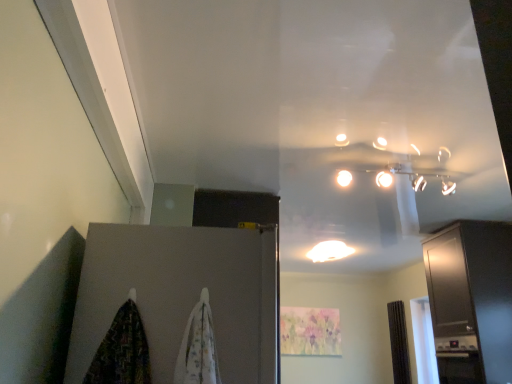
Where is `white glossy light fixture at center`? white glossy light fixture at center is located at coordinates (329, 251).

What do you see at coordinates (180, 295) in the screenshot? I see `matte gray door at lower left` at bounding box center [180, 295].

At what (x,y) coordinates should I click in order to perform the action: click on satin black cabinet at right. Please return your answer as a coordinate pair (x, y). This screenshot has width=512, height=384. Looking at the image, I should click on (471, 301).

From the image's perspective, which one is positioned higher, satin black cabinet at right or matte gray door at lower left?

matte gray door at lower left, from the image's perspective.

Is satin black cabinet at right facing towards matte gray door at lower left?

No, satin black cabinet at right is not oriented towards matte gray door at lower left.

Does satin black cabinet at right have a greater height compared to matte gray door at lower left?

Yes, satin black cabinet at right is taller than matte gray door at lower left.

Is the depth of satin black cabinet at right greater than that of brown textured curtain at right, positioned as the 1th curtain in back-to-front order?

No, it is not.

Is satin black cabinet at right facing towards brown textured curtain at right, marked as the second curtain in a left-to-right arrangement?

No.

Considering the sizes of satin black cabinet at right and brown textured curtain at right, positioned as the 1th curtain in back-to-front order, in the image, is satin black cabinet at right wider or thinner than brown textured curtain at right, positioned as the 1th curtain in back-to-front order,?

Considering their sizes, satin black cabinet at right looks broader than brown textured curtain at right, positioned as the 1th curtain in back-to-front order.

From the image's perspective, relative to brown textured curtain at right, marked as the second curtain in a left-to-right arrangement, is satin black cabinet at right above or below?

satin black cabinet at right is situated higher than brown textured curtain at right, marked as the second curtain in a left-to-right arrangement, in the image.

From a real-world perspective, between white fabric curtain at center, which appears as the 2th curtain when ordered from the bottom, and brown textured curtain at right, which ranks as the second curtain in front-to-back order, who is vertically higher?

From a 3D spatial view, brown textured curtain at right, which ranks as the second curtain in front-to-back order, is above.

In terms of height, does white fabric curtain at center, the 1th curtain viewed from the top, look taller or shorter compared to brown textured curtain at right, acting as the first curtain starting from the bottom?

In the image, white fabric curtain at center, the 1th curtain viewed from the top, appears to be shorter than brown textured curtain at right, acting as the first curtain starting from the bottom.

Between white fabric curtain at center, which appears as the 2th curtain when ordered from the bottom, and brown textured curtain at right, which ranks as the second curtain in front-to-back order, which one has larger width?

Wider between the two is white fabric curtain at center, which appears as the 2th curtain when ordered from the bottom.

Does white fabric curtain at center, marked as the 2th curtain in a right-to-left arrangement, have a larger size compared to brown textured curtain at right, the first curtain in the right-to-left sequence?

Actually, white fabric curtain at center, marked as the 2th curtain in a right-to-left arrangement, might be smaller than brown textured curtain at right, the first curtain in the right-to-left sequence.

Locate an element on the screen. The height and width of the screenshot is (384, 512). curtain behind the matte gray door at lower left is located at coordinates (399, 342).

How many degrees apart are the facing directions of matte gray door at lower left and brown textured curtain at right, positioned as the 1th curtain in back-to-front order?

180 degrees.

Looking at the image, does matte gray door at lower left seem bigger or smaller compared to brown textured curtain at right, acting as the first curtain starting from the bottom?

matte gray door at lower left is bigger than brown textured curtain at right, acting as the first curtain starting from the bottom.

Is matte gray door at lower left facing away from brown textured curtain at right, which ranks as the second curtain in front-to-back order?

No, matte gray door at lower left is not facing the opposite direction of brown textured curtain at right, which ranks as the second curtain in front-to-back order.

Considering the positions of points (396, 357) and (215, 306), is point (396, 357) farther from camera compared to point (215, 306)?

Yes, point (396, 357) is farther from viewer.

Is brown textured curtain at right, marked as the second curtain in a left-to-right arrangement, with matte gray door at lower left?

No, brown textured curtain at right, marked as the second curtain in a left-to-right arrangement, is not beside matte gray door at lower left.

You are a GUI agent. You are given a task and a screenshot of the screen. Output one action in this format:
    pyautogui.click(x=<x>, y=<y>)
    Task: Click on the curtain below the matte gray door at lower left (from the image's perspective)
    The image size is (512, 384).
    Given the screenshot: What is the action you would take?
    pyautogui.click(x=399, y=342)

Would you say brown textured curtain at right, the first curtain in the right-to-left sequence, is outside matte gray door at lower left?

Indeed, brown textured curtain at right, the first curtain in the right-to-left sequence, is completely outside matte gray door at lower left.

Is the position of white glossy light fixture at center more distant than that of matte gray door at lower left?

Yes.

Does point (327, 251) come in front of point (270, 344)?

No, (327, 251) is further to viewer.

Can you confirm if white glossy light fixture at center is shorter than matte gray door at lower left?

Indeed, white glossy light fixture at center has a lesser height compared to matte gray door at lower left.

Measure the distance between white glossy light fixture at center and matte gray door at lower left.

white glossy light fixture at center and matte gray door at lower left are 3.15 meters apart.

From the image's perspective, between matte gray door at lower left and white glossy light fixture at center, who is located below?

white glossy light fixture at center.

Can you confirm if matte gray door at lower left is thinner than white glossy light fixture at center?

Incorrect, the width of matte gray door at lower left is not less than that of white glossy light fixture at center.

Is matte gray door at lower left next to white glossy light fixture at center?

No, matte gray door at lower left is not beside white glossy light fixture at center.

Is white glossy light fixture at center completely or partially inside matte gray door at lower left?

Actually, white glossy light fixture at center is outside matte gray door at lower left.

In the image, there is a satin black cabinet at right. What are the coordinates of `door below it (from a real-world perspective)` in the screenshot? It's located at (180, 295).

Where is `the 1st curtain to the left of the satin black cabinet at right, starting your count from the anchor`? The image size is (512, 384). the 1st curtain to the left of the satin black cabinet at right, starting your count from the anchor is located at coordinates (399, 342).

Considering their positions, is brown textured curtain at right, which ranks as the second curtain in front-to-back order, positioned further to matte gray door at lower left than white glossy light fixture at center?

Among the two, brown textured curtain at right, which ranks as the second curtain in front-to-back order, is located further to matte gray door at lower left.

Which object lies further to the anchor point matte gray door at lower left, white glossy light fixture at center or satin black cabinet at right?

white glossy light fixture at center is positioned further to the anchor matte gray door at lower left.

In the scene shown: When comparing their distances from brown textured curtain at right, the 2th curtain positioned from the top, does white fabric curtain at center, the 1th curtain viewed from the top, or satin black cabinet at right seem closer?

satin black cabinet at right is positioned closer to the anchor brown textured curtain at right, the 2th curtain positioned from the top.

Looking at the image, which one is located closer to white fabric curtain at center, which is counted as the 2th curtain, starting from the back, satin black cabinet at right or matte gray door at lower left?

matte gray door at lower left.

Looking at the image, which one is located further to brown textured curtain at right, the first curtain in the right-to-left sequence, matte gray door at lower left or satin black cabinet at right?

Based on the image, matte gray door at lower left appears to be further to brown textured curtain at right, the first curtain in the right-to-left sequence.

When comparing their distances from white glossy light fixture at center, does satin black cabinet at right or matte gray door at lower left seem further?

Among the two, matte gray door at lower left is located further to white glossy light fixture at center.

In the scene shown: When comparing their distances from brown textured curtain at right, which ranks as the second curtain in front-to-back order, does satin black cabinet at right or matte gray door at lower left seem further?

matte gray door at lower left lies further to brown textured curtain at right, which ranks as the second curtain in front-to-back order, than the other object.

Estimate the real-world distances between objects in this image. Which object is further from white glossy light fixture at center, brown textured curtain at right, the first curtain in the right-to-left sequence, or satin black cabinet at right?

brown textured curtain at right, the first curtain in the right-to-left sequence, lies further to white glossy light fixture at center than the other object.

Identify the location of cabinetry between matte gray door at lower left and white glossy light fixture at center along the z-axis. Image resolution: width=512 pixels, height=384 pixels. (471, 301).

Locate an element on the screen. door between white fabric curtain at center, which appears as the 2th curtain when ordered from the bottom, and white glossy light fixture at center, along the z-axis is located at coordinates (180, 295).

The height and width of the screenshot is (384, 512). What are the coordinates of `lighting between matte gray door at lower left and brown textured curtain at right, positioned as the 1th curtain in back-to-front order, along the z-axis` in the screenshot? It's located at (x=329, y=251).

The width and height of the screenshot is (512, 384). I want to click on cabinetry positioned between white fabric curtain at center, marked as the first curtain in a front-to-back arrangement, and white glossy light fixture at center from near to far, so click(x=471, y=301).